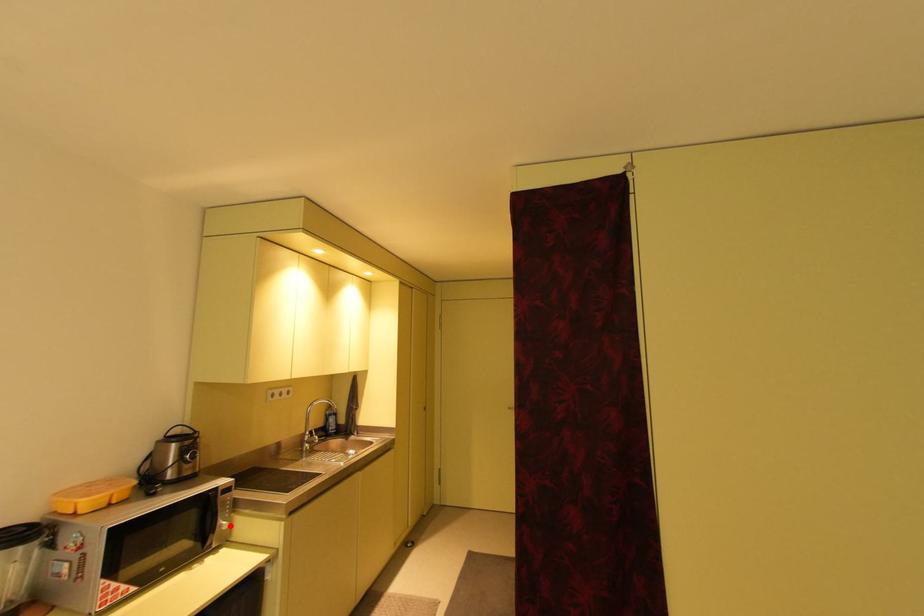
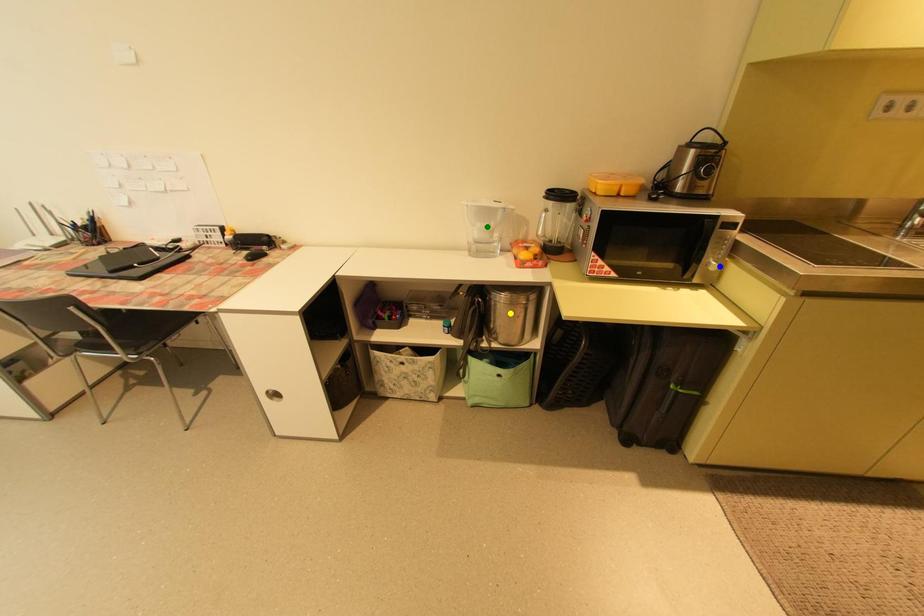
Question: I am providing you with two images of the same scene from different viewpoints. A red point is marked on the first image. You are given multiple points on the second image. In image 2, which mark is for the same physical point as the one in image 1?

Choices:
 (A) yellow point
 (B) blue point
 (C) green point

Answer: (B)